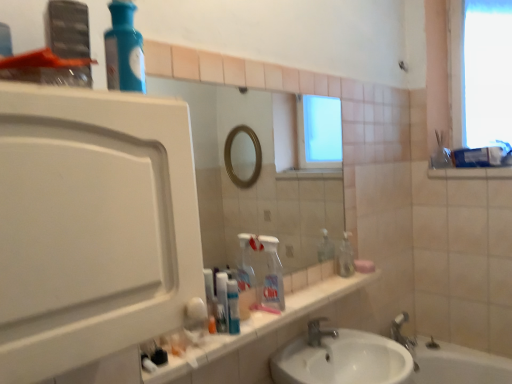
This screenshot has height=384, width=512. I want to click on vacant area located to the right-hand side of silver metallic faucet at sink center, so click(x=366, y=346).